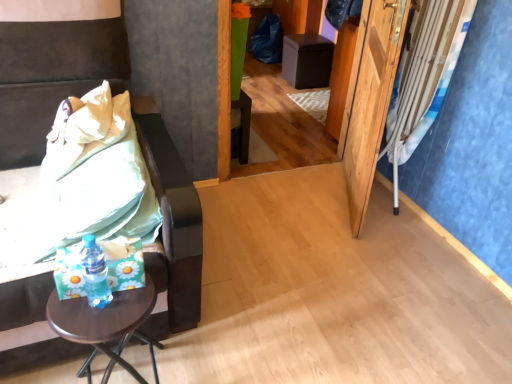
Identify the location of free space between brown wooden side table at left, arranged as the 2th furniture when viewed from the top, and blue fabric curtain at right. (279, 235).